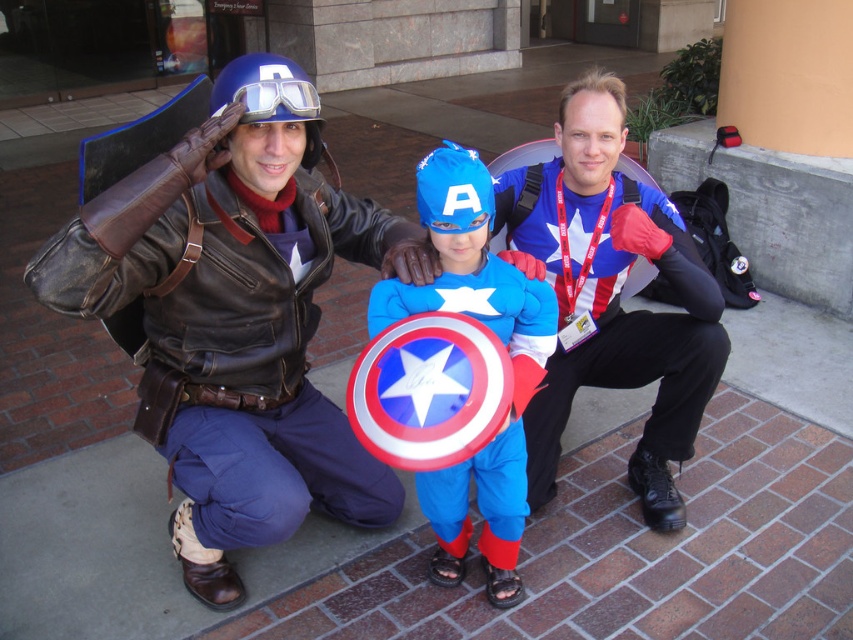
Question: Can you confirm if shiny blue costume at center is thinner than blue matte helmet at upper center?

Choices:
 (A) no
 (B) yes

Answer: (A)

Question: Does leather jacket at left appear on the left side of blue matte helmet at upper center?

Choices:
 (A) yes
 (B) no

Answer: (A)

Question: Is blue fabric shirt at center bigger than blue matte helmet at upper center?

Choices:
 (A) no
 (B) yes

Answer: (B)

Question: Considering the real-world distances, which object is farthest from the blue matte helmet at upper center?

Choices:
 (A) leather jacket at left
 (B) shiny blue costume at center
 (C) blue fabric shirt at center

Answer: (C)

Question: Which of the following is the farthest from the observer?

Choices:
 (A) (577, 362)
 (B) (454, 192)
 (C) (463, 257)

Answer: (A)

Question: Which object appears farthest from the camera in this image?

Choices:
 (A) blue matte helmet at upper center
 (B) leather jacket at left
 (C) blue fabric shirt at center

Answer: (C)